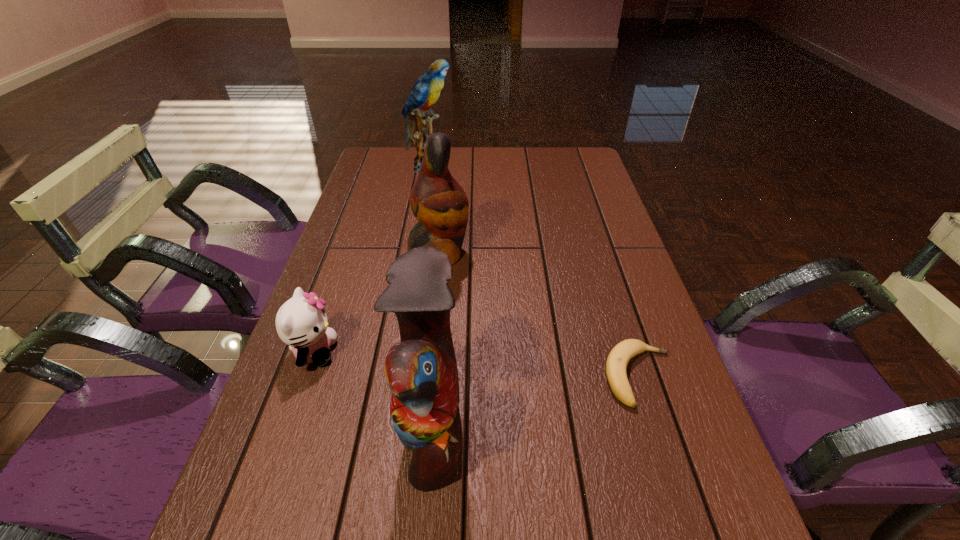
Locate an element on the screen. vacant region located on the front-facing side of the kitten is located at coordinates (475, 352).

Identify the location of free location located 0.160m on the left of the rightmost object. Image resolution: width=960 pixels, height=540 pixels. [523, 376].

The width and height of the screenshot is (960, 540). I want to click on object at the far edge, so click(426, 91).

Where is `parrot that is positioned at the left edge`? The height and width of the screenshot is (540, 960). parrot that is positioned at the left edge is located at coordinates (426, 91).

You are a GUI agent. You are given a task and a screenshot of the screen. Output one action in this format:
    pyautogui.click(x=<x>, y=<y>)
    Task: Click on the kitten that is positioned at the left edge
    
    Given the screenshot: What is the action you would take?
    pyautogui.click(x=301, y=322)

Locate an element on the screen. The height and width of the screenshot is (540, 960). object at the right edge is located at coordinates (616, 365).

You are a GUI agent. You are given a task and a screenshot of the screen. Output one action in this format:
    pyautogui.click(x=<x>, y=<y>)
    Task: Click on the object that is at the far left corner
    This screenshot has height=540, width=960.
    Given the screenshot: What is the action you would take?
    pyautogui.click(x=426, y=91)

This screenshot has height=540, width=960. I want to click on vacant region at the far edge of the desktop, so click(513, 161).

Image resolution: width=960 pixels, height=540 pixels. Identify the location of free space at the left edge. (271, 439).

Where is `blank space at the right edge of the desktop`? blank space at the right edge of the desktop is located at coordinates (582, 226).